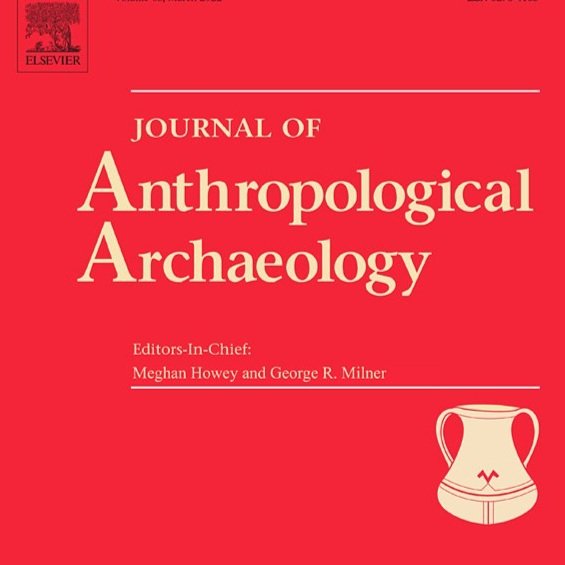
At what (x,y) coordinates should I click in order to perform the action: click on top of pot. Please return your answer as a coordinate pair (x, y). This screenshot has width=565, height=565. Looking at the image, I should click on (475, 410).